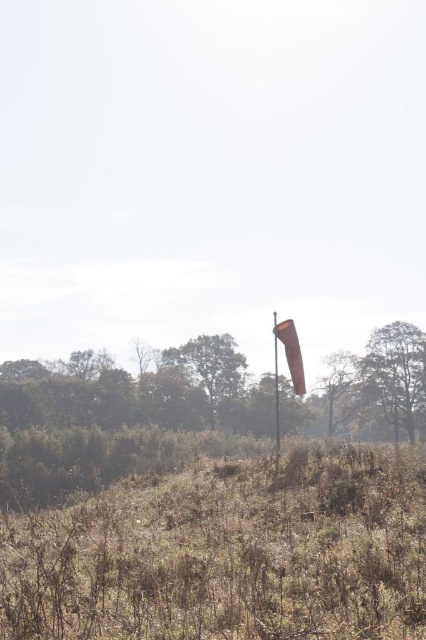
You are a bird looking for a high perch to survey the field. Which of the two objects, the brown textured tree at right or the smooth orange flag pole at center, would allow you to see further across the field?

The brown textured tree at right is much taller as smooth orange flag pole at center, so the brown textured tree at right would provide a higher vantage point for the bird to see further across the field.

You are standing in the rural landscape and want to walk towards the green leafy tree at center. Which direction should you head relative to the red windsock attached to the tall pole in the midground?

The green leafy tree at center is located at point (210, 365), which is to the left of the red windsock at center right. Therefore, you should head to the left relative to the red windsock to reach the green leafy tree at center.

You are a farmer checking the weather conditions in your field. You notice the brown fabric flag at center and the smooth orange flag pole at center. Which object is higher up in the sky?

The brown fabric flag at center is above the smooth orange flag pole at center, so it is higher up in the sky.